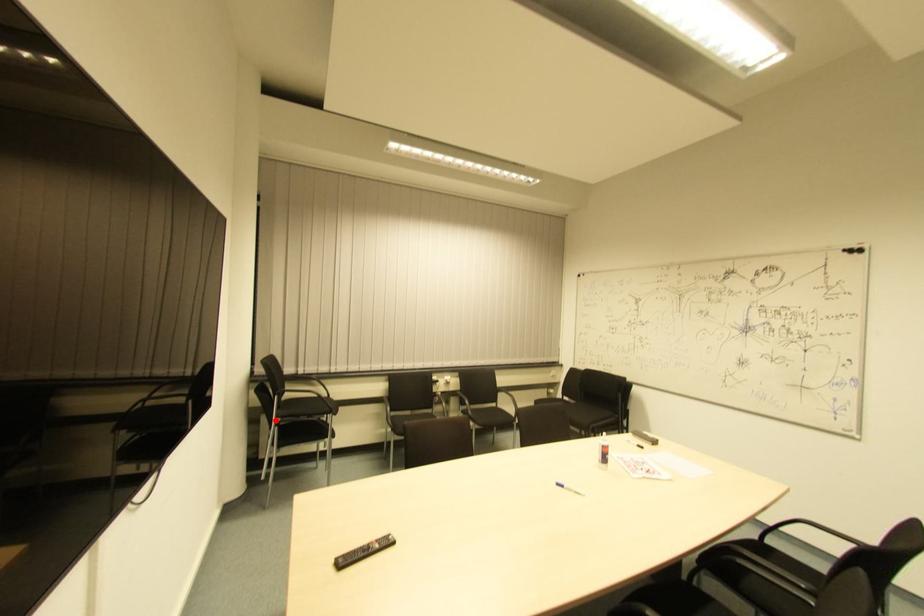
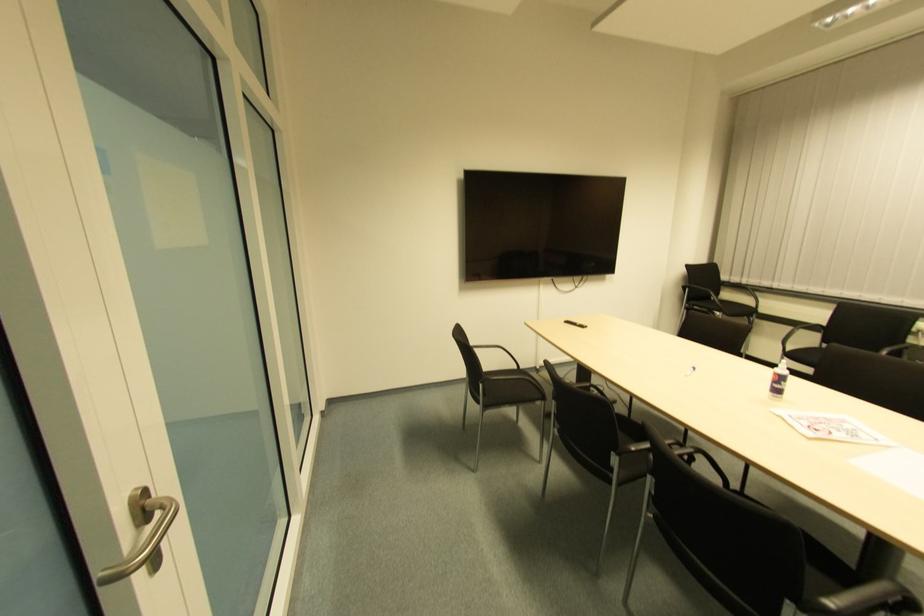
Question: A red point is marked in image1. In image2, is the corresponding 3D point closer to the camera or farther? Reply with the corresponding letter.

Choices:
 (A) The corresponding 3D point is closer.
 (B) The corresponding 3D point is farther.

Answer: (A)